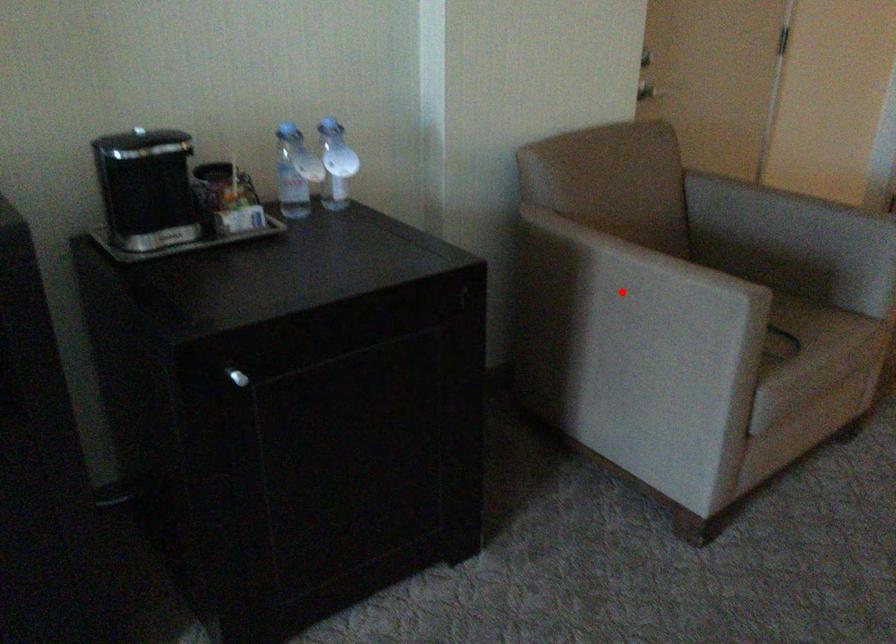
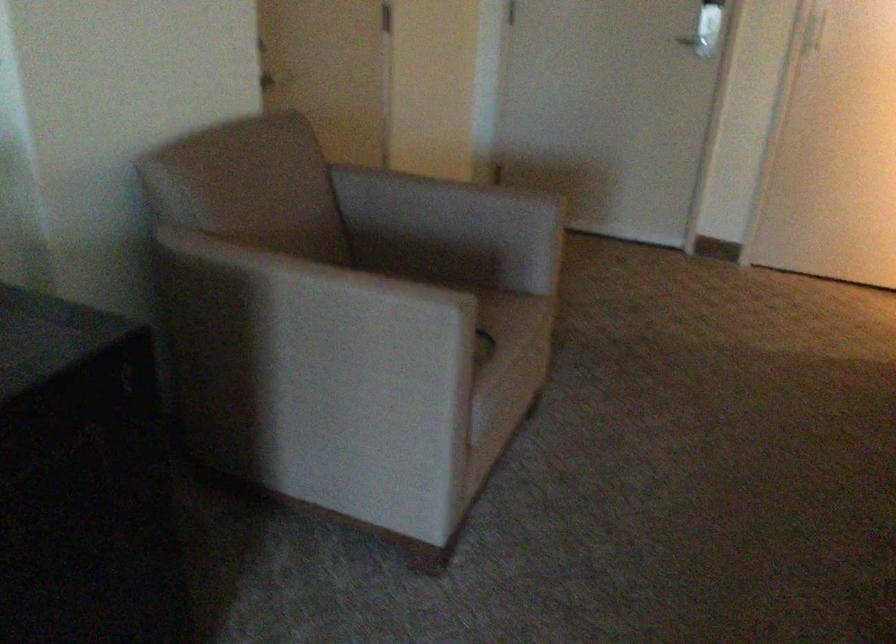
Question: I am providing you with two images of the same scene from different viewpoints. In image1, a red point is highlighted. Considering the same 3D point in image2, which of the following is correct?

Choices:
 (A) It is closer
 (B) It is farther

Answer: (A)